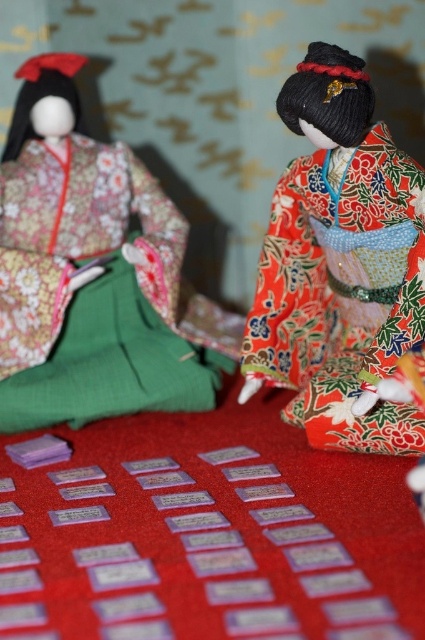
You are organizing a cultural exhibition and need to place two dolls on a shelf. The shelf has a height limit of 30 cm. The dolls are wearing the matte floral kimono at left and the shiny red kimono at right. Which doll might exceed the height limit?

The matte floral kimono at left is taller than the shiny red kimono at right. Since the shelf has a height limit of 30 cm, the doll wearing the matte floral kimono at left might exceed the limit if its height is over 30 cm.